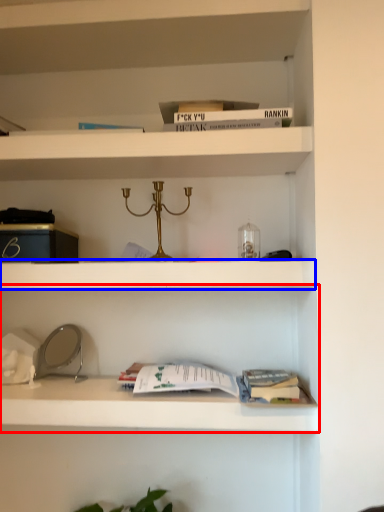
Question: Which of the following is the closest to the observer, shelf (highlighted by a red box) or cabinet (highlighted by a blue box)?

Choices:
 (A) shelf
 (B) cabinet

Answer: (A)